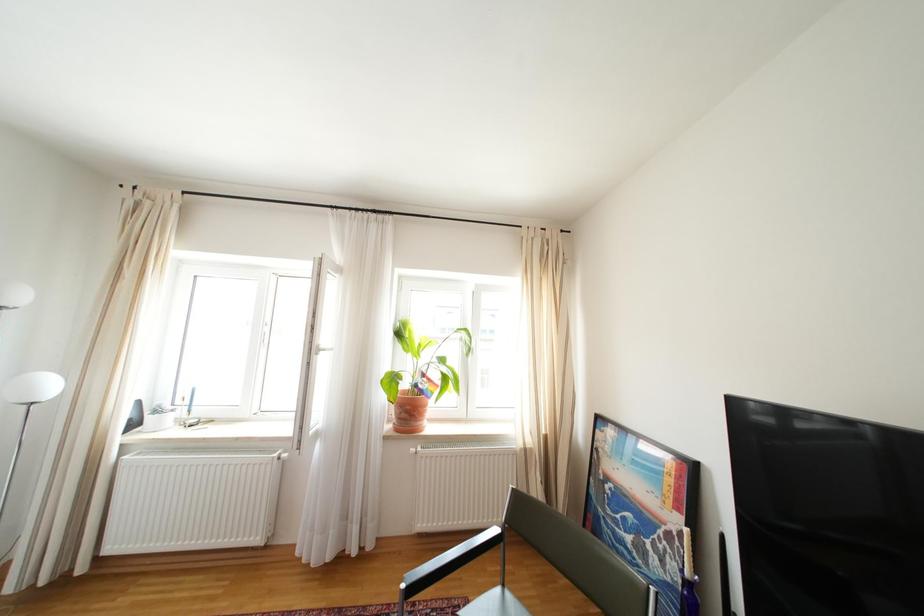
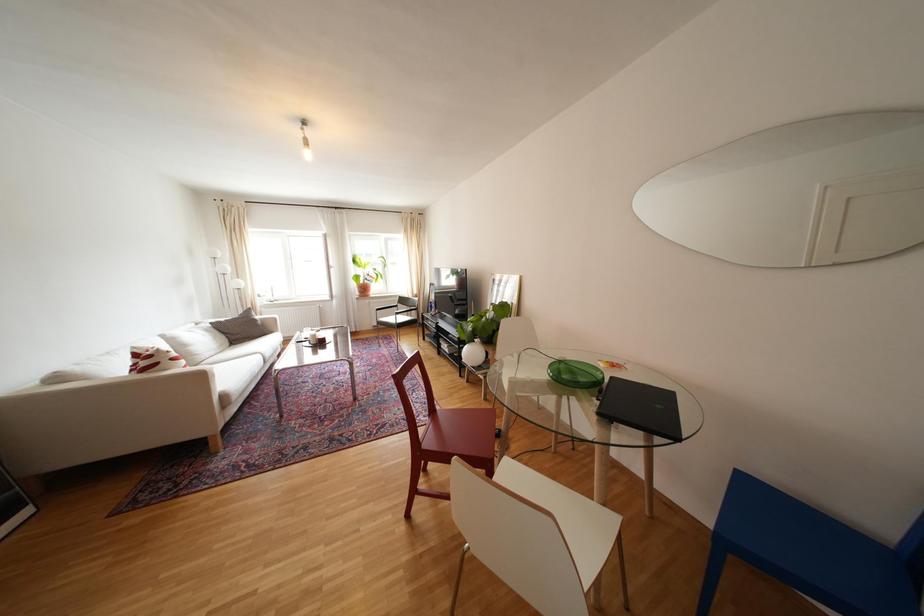
Question: In a continuous first-person perspective shot, in which direction is the camera moving?

Choices:
 (A) Left
 (B) Right
 (C) Forward
 (D) Backward

Answer: (D)